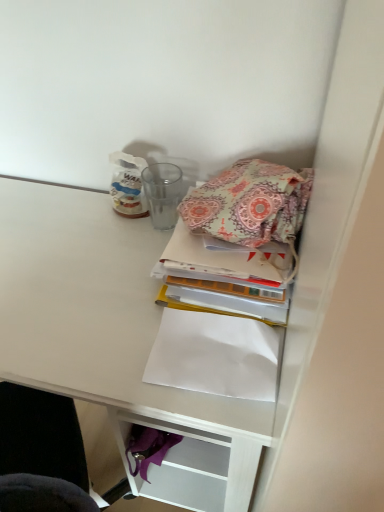
Identify the location of vacant area on top of paisley fabric book at center (from a real-world perspective). (221, 245).